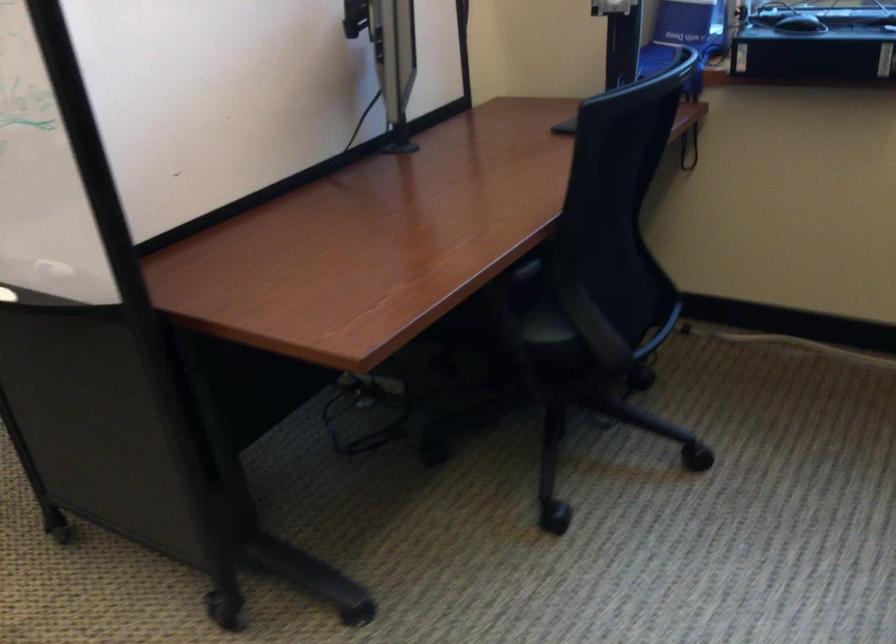
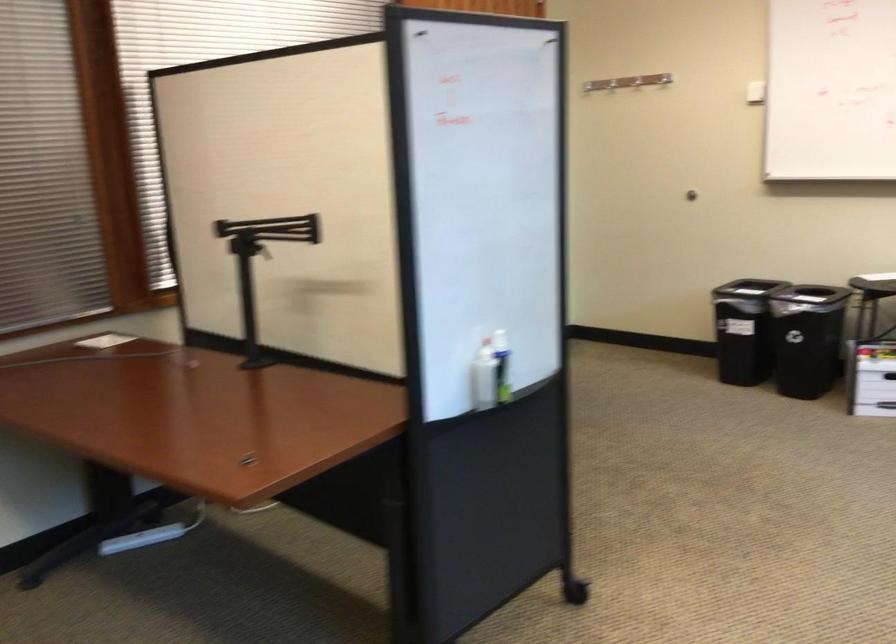
Consider the image. Based on the continuous images, in which direction is the camera rotating?

The camera rotated toward left-down.